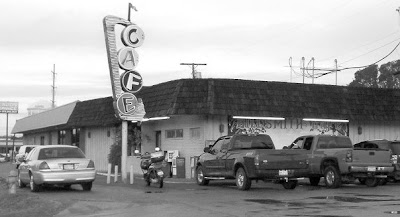
Identify the location of building window. (179, 136), (64, 137).